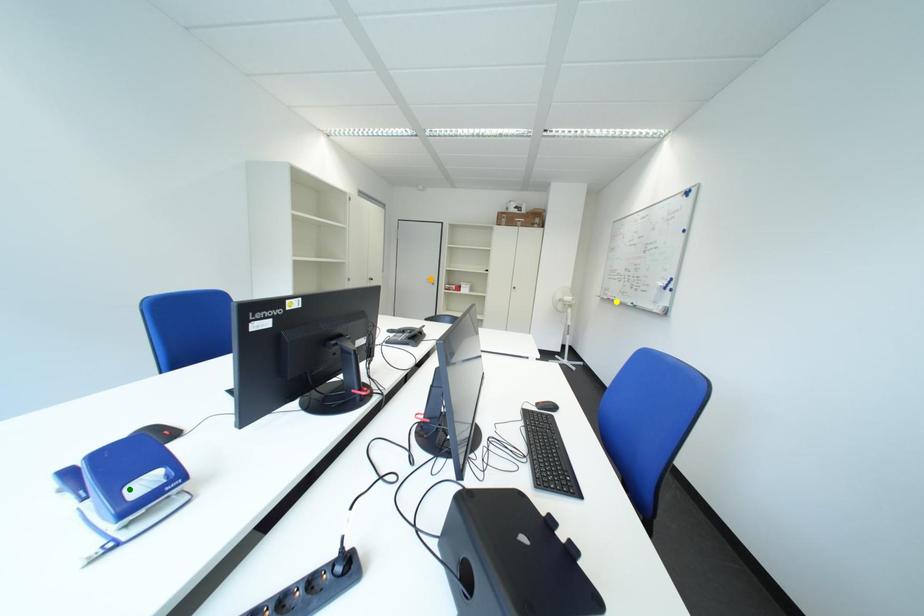
Order these from nearest to farthest:
orange point | green point | yellow point

green point
yellow point
orange point